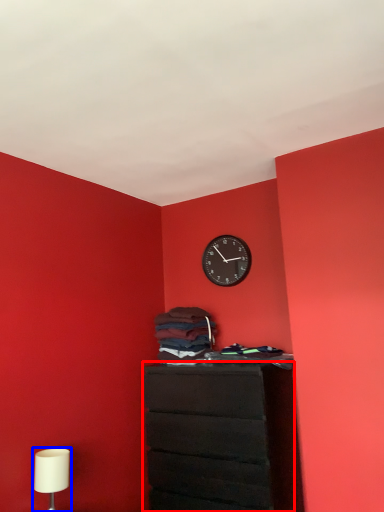
Question: Which object is further to the camera taking this photo, chest of drawers (highlighted by a red box) or table lamp (highlighted by a blue box)?

Choices:
 (A) chest of drawers
 (B) table lamp

Answer: (A)